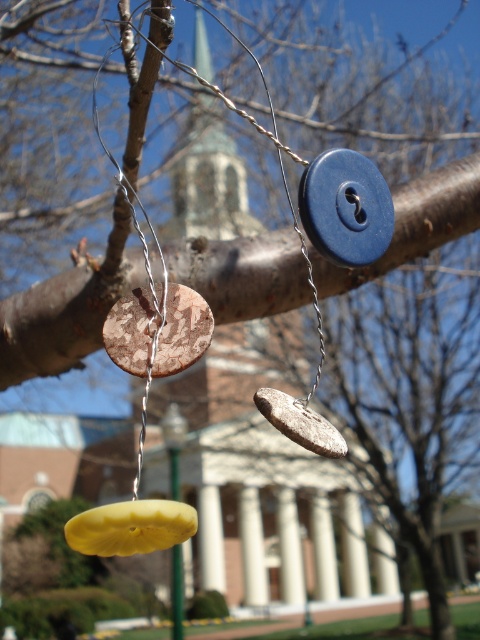
What do you see at coordinates (346, 208) in the screenshot? I see `blue matte button at center` at bounding box center [346, 208].

Can you confirm if blue matte button at center is positioned to the right of rustic wood coin at center?

Correct, you'll find blue matte button at center to the right of rustic wood coin at center.

I want to click on blue matte button at center, so click(346, 208).

Can you confirm if rustic wood coin at center is smaller than rusty metallic coin at center?

Yes, rustic wood coin at center is smaller than rusty metallic coin at center.

Does rustic wood coin at center appear on the left side of rusty metallic coin at center?

Yes, rustic wood coin at center is to the left of rusty metallic coin at center.

Identify the location of rustic wood coin at center. The height and width of the screenshot is (640, 480). (157, 330).

The image size is (480, 640). What are the coordinates of `blue matte button at center` in the screenshot? It's located at (346, 208).

Which is above, blue matte button at center or yellow matte coin at lower center?

Positioned higher is blue matte button at center.

Is point (317, 172) more distant than point (180, 512)?

Yes, it is behind point (180, 512).

Locate an element on the screen. blue matte button at center is located at coordinates (346, 208).